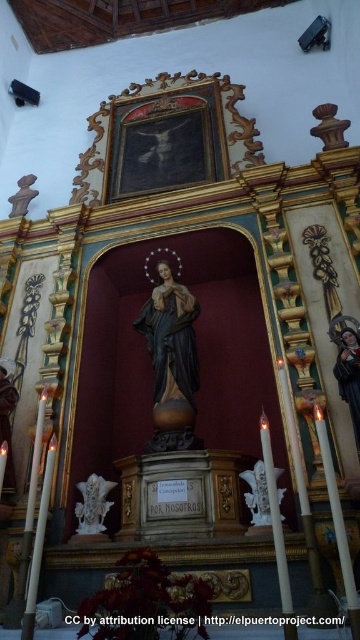
You are a photographer standing in front of the religious altar. You want to take a closeup photo of the smooth skin figure at center. Given that your camera has a minimum focusing distance of 2 meters, will you be able to take the photo without moving closer?

The smooth skin figure at center is 17.98 meters from the camera. Since the minimum focusing distance is 2 meters, you can take the closeup photo without moving closer because the figure is within the camera range.